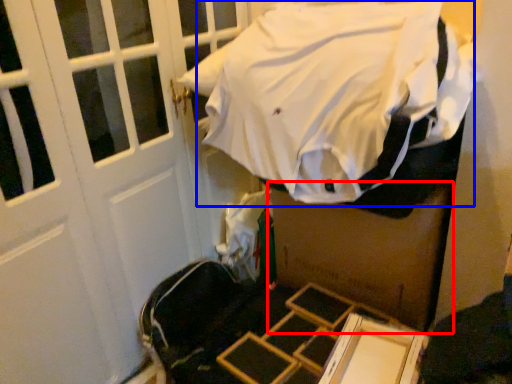
Question: Among these objects, which one is nearest to the camera, box (highlighted by a red box) or sheet (highlighted by a blue box)?

Choices:
 (A) box
 (B) sheet

Answer: (B)